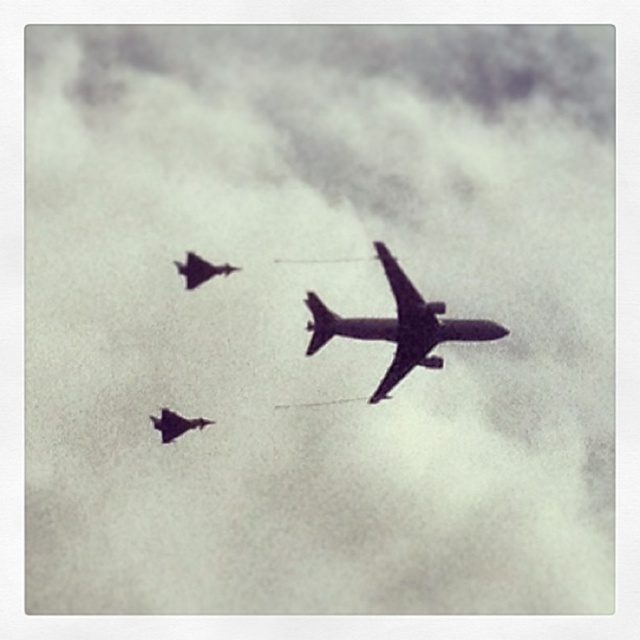
Question: Which object is the farthest from the shiny metallic airplane at center?

Choices:
 (A) shiny dark gray jet at lower left
 (B) shiny dark gray jet at left

Answer: (A)

Question: Does shiny metallic airplane at center appear on the right side of shiny dark gray jet at lower left?

Choices:
 (A) no
 (B) yes

Answer: (B)

Question: Which point is closer to the camera taking this photo?

Choices:
 (A) (456, 337)
 (B) (193, 253)
 (C) (170, 420)

Answer: (C)

Question: Can you confirm if shiny metallic airplane at center is bigger than shiny dark gray jet at left?

Choices:
 (A) yes
 (B) no

Answer: (A)

Question: Does shiny metallic airplane at center appear over shiny dark gray jet at lower left?

Choices:
 (A) no
 (B) yes

Answer: (B)

Question: Which point is farther to the camera?

Choices:
 (A) shiny dark gray jet at left
 (B) shiny dark gray jet at lower left

Answer: (A)